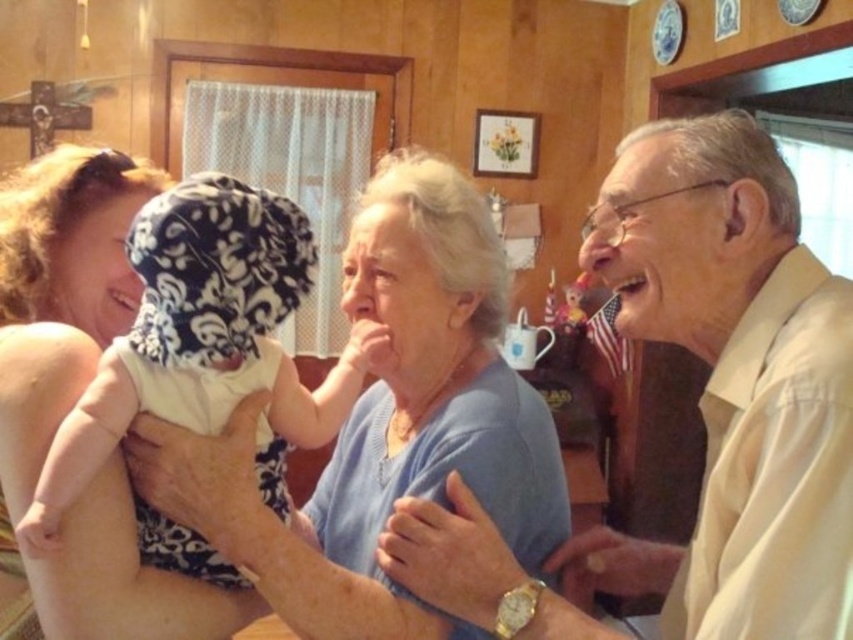
Based on the scene description, which object is positioned to the left of the other? The light beige shirt at center or the smooth skin mouth at upper right?

The light beige shirt at center is to the left of the smooth skin mouth at upper right.

Based on the photo, in the scene, there is a white cotton baby at center and a smooth skin mouth at upper right. Which object is taller?

The white cotton baby at center is taller than the smooth skin mouth at upper right.